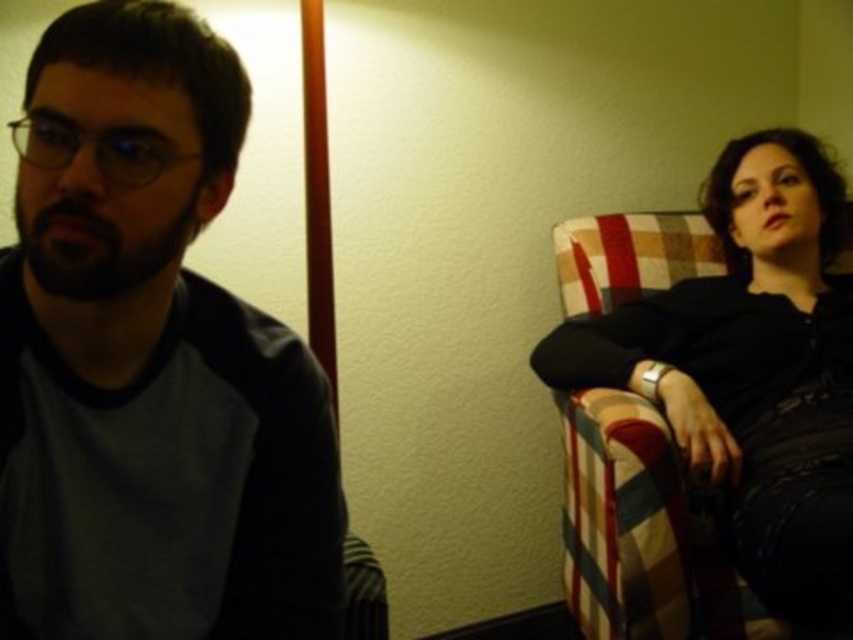
Question: From the image, what is the correct spatial relationship of matte gray shirt at left in relation to black leather jacket at right?

Choices:
 (A) below
 (B) above

Answer: (B)

Question: Is matte gray shirt at left to the left of black leather jacket at right from the viewer's perspective?

Choices:
 (A) no
 (B) yes

Answer: (B)

Question: Does matte gray shirt at left have a larger size compared to black leather jacket at right?

Choices:
 (A) no
 (B) yes

Answer: (A)

Question: Which object appears farthest from the camera in this image?

Choices:
 (A) black leather jacket at right
 (B) matte gray shirt at left

Answer: (A)

Question: Which of the following is the farthest from the observer?

Choices:
 (A) (154, 611)
 (B) (830, 493)

Answer: (B)